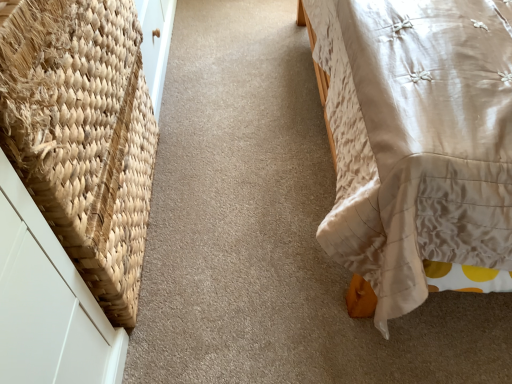
Question: Looking at their shapes, would you say white satin bed at right is wider or thinner than natural woven basket at left?

Choices:
 (A) wide
 (B) thin

Answer: (A)

Question: Is white satin bed at right bigger or smaller than natural woven basket at left?

Choices:
 (A) big
 (B) small

Answer: (A)

Question: Is point (368, 208) closer or farther from the camera than point (126, 327)?

Choices:
 (A) closer
 (B) farther

Answer: (A)

Question: In terms of height, does natural woven basket at left look taller or shorter compared to white satin bed at right?

Choices:
 (A) short
 (B) tall

Answer: (A)

Question: Is natural woven basket at left inside the boundaries of white satin bed at right, or outside?

Choices:
 (A) outside
 (B) inside

Answer: (A)

Question: Would you say natural woven basket at left is to the left or to the right of white satin bed at right in the picture?

Choices:
 (A) left
 (B) right

Answer: (A)

Question: From a real-world perspective, relative to white satin bed at right, is natural woven basket at left vertically above or below?

Choices:
 (A) above
 (B) below

Answer: (B)